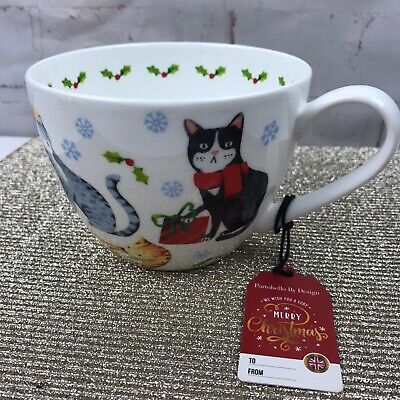
I want to click on one teacup holder, so click(238, 181), click(330, 101).